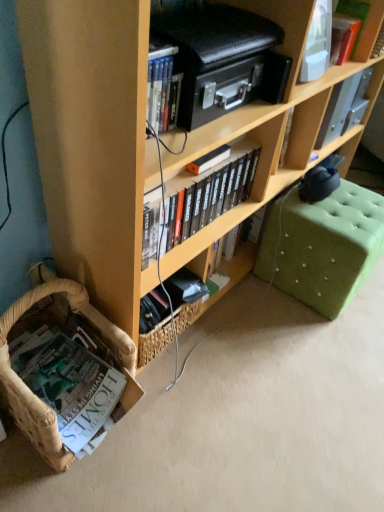
Question: From the image's perspective, is wooden bookcase at lower left located above or below green tufted ottoman at lower right?

Choices:
 (A) above
 (B) below

Answer: (A)

Question: Based on their positions, is wooden bookcase at lower left located to the left or right of green tufted ottoman at lower right?

Choices:
 (A) right
 (B) left

Answer: (B)

Question: Which object is positioned closest to the hardcover book at upper right, acting as the 1th book starting from the top?

Choices:
 (A) black matte bookshelf at center, the second book when ordered from right to left
 (B) wooden bookcase at lower left
 (C) white plastic container at upper right
 (D) white paper book at lower left, the 3th book when ordered from top to bottom
 (E) green tufted ottoman at lower right

Answer: (C)

Question: Considering the real-world distances, which object is farthest from the green tufted ottoman at lower right?

Choices:
 (A) black matte bookshelf at center, the second book when ordered from right to left
 (B) white paper book at lower left, which is the 1th book in bottom-to-top order
 (C) white plastic container at upper right
 (D) hardcover book at upper right, which is the 1th book in right-to-left order
 (E) wooden bookcase at lower left

Answer: (B)